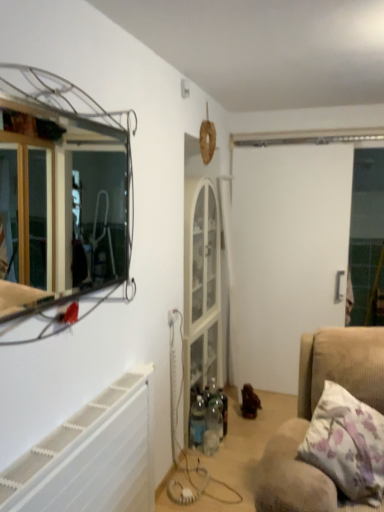
The image size is (384, 512). Find the location of `vacant region in front of brown wooden toy at center`. vacant region in front of brown wooden toy at center is located at coordinates (267, 424).